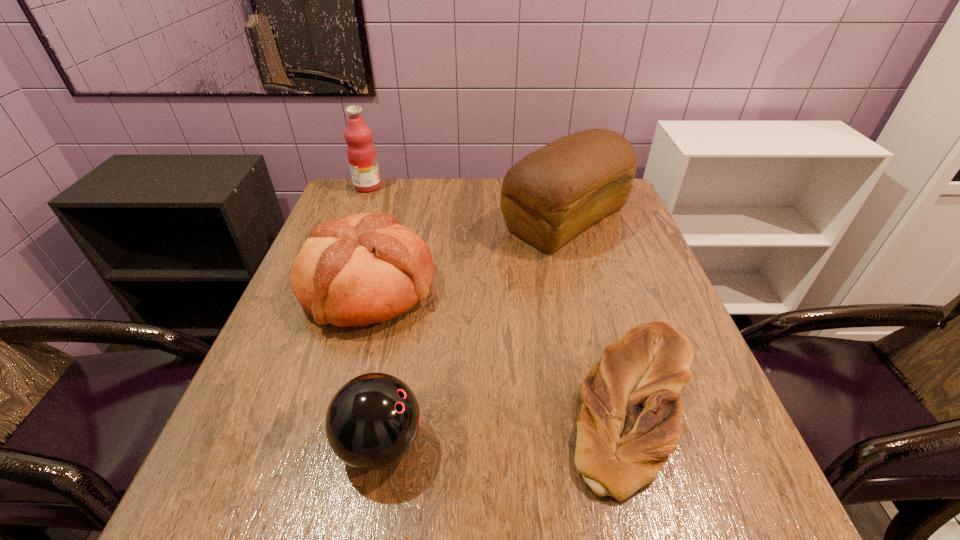
The height and width of the screenshot is (540, 960). I want to click on fruit juice that is at the far edge, so click(361, 152).

Find the location of `bread located in the far edge section of the desktop`. bread located in the far edge section of the desktop is located at coordinates (551, 195).

Identify the location of bowling ball that is at the near edge. tap(372, 421).

Where is `bread at the near edge`? This screenshot has width=960, height=540. bread at the near edge is located at coordinates (631, 418).

Where is `fruit juice positioned at the left edge`? fruit juice positioned at the left edge is located at coordinates (361, 152).

Identify the location of bread positioned at the left edge. (367, 268).

You are a GUI agent. You are given a task and a screenshot of the screen. Output one action in this format:
    pyautogui.click(x=<x>, y=<y>)
    Task: Click on the object positioned at the far left corner
    This screenshot has width=960, height=540.
    Given the screenshot: What is the action you would take?
    pyautogui.click(x=361, y=152)

Image resolution: width=960 pixels, height=540 pixels. I want to click on object situated at the far right corner, so click(551, 195).

Locate an element on the screen. The height and width of the screenshot is (540, 960). object at the near right corner is located at coordinates (631, 418).

The width and height of the screenshot is (960, 540). In the image, there is a desktop. In order to click on free space at the far edge in this screenshot , I will do `click(388, 210)`.